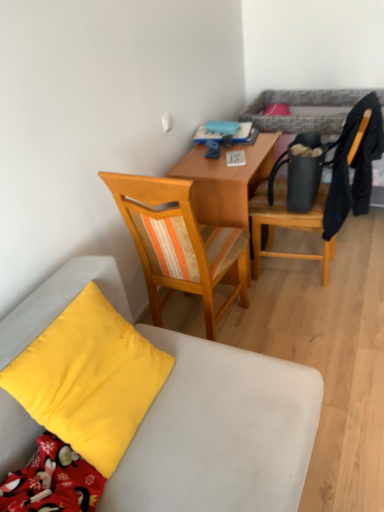
This screenshot has width=384, height=512. Identify the location of blank space situated above wooden chair at center, the second chair positioned from the left (from a real-world perspective). (307, 294).